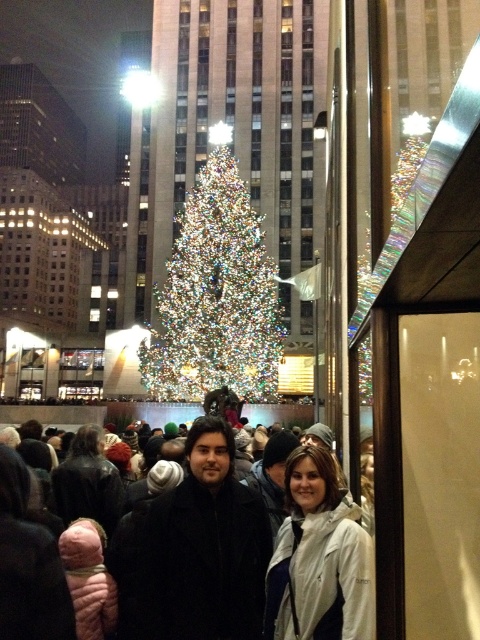
You are a photographer trying to capture a photo of both the black wool coat at center and the white matte jacket at center. Since you want both subjects to be in focus, you need to know which one is closer to you. Can you tell me which one is nearer?

The black wool coat at center is closer to the viewer than the white matte jacket at center, so you should adjust your focus to ensure both are in sharp detail.

From the picture: You are a photographer standing in the crowd at the lively urban scene. You want to take a photo of the black wool coat at center and the illuminated glass christmas tree at center. Which object will appear taller in the photo?

The illuminated glass christmas tree at center will appear taller in the photo because it is taller than the black wool coat at center.

You are standing in the middle of a bustling city square at night, surrounded by tall buildings lit up with holiday lights. You notice a point marked at coordinates (265, 372). Given that you are 73.06 meters away from this point, can you estimate how far you would need to walk to reach it?

The point at (265, 372) is 73.06 meters away from you, so you would need to walk approximately 73.06 meters to reach it.